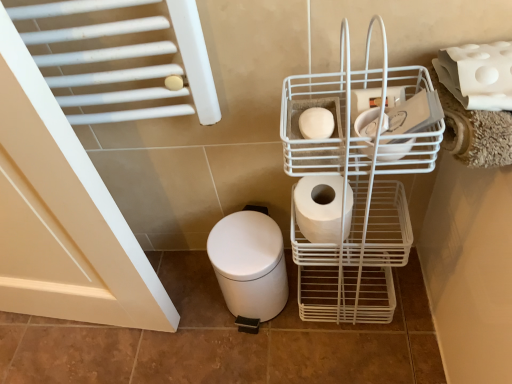
Locate an element on the screen. The height and width of the screenshot is (384, 512). vacant space to the left of white matte toilet bowl at lower left is located at coordinates (190, 317).